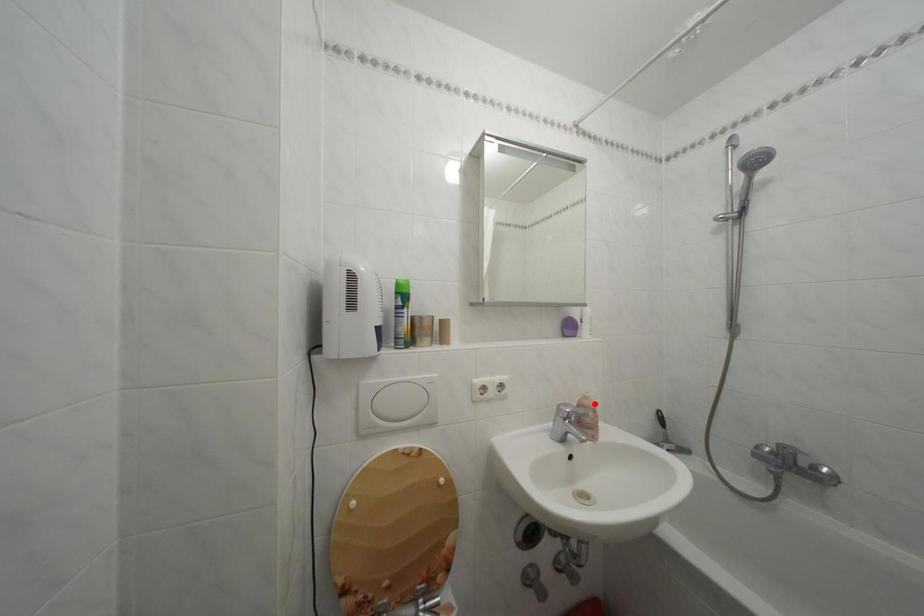
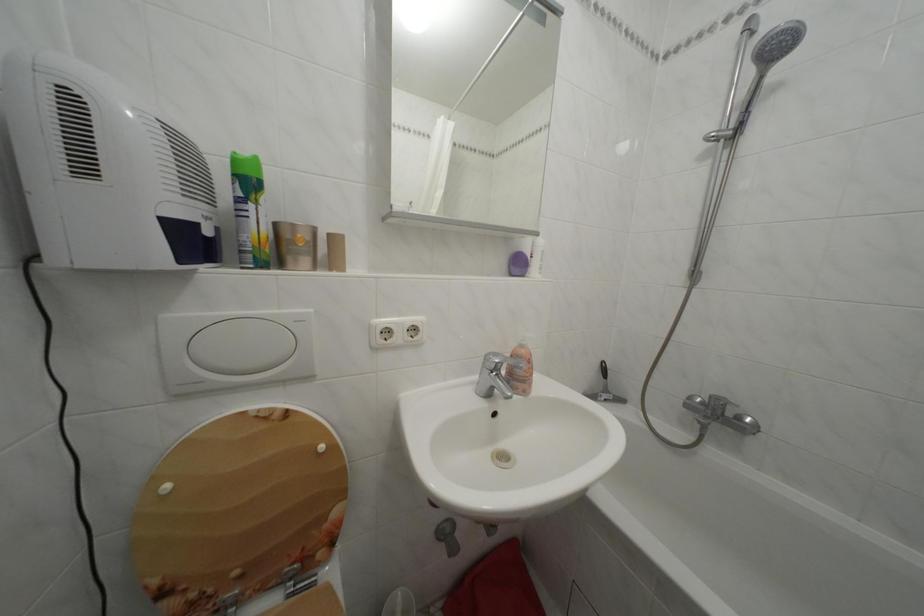
The point at the highlighted location is marked in the first image. Where is the corresponding point in the second image?

(530, 352)